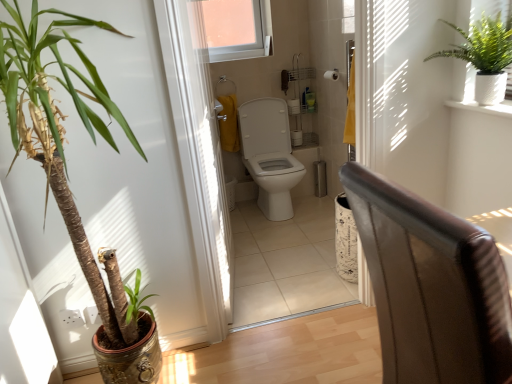
Question: Should I look upward or downward to see white plastic screen door at center?

Choices:
 (A) down
 (B) up

Answer: (B)

Question: From the image's perspective, would you say white matte toilet paper at upper center is shown under white glossy toilet at center?

Choices:
 (A) no
 (B) yes

Answer: (A)

Question: Considering the relative sizes of white matte toilet paper at upper center and white glossy toilet at center in the image provided, is white matte toilet paper at upper center wider than white glossy toilet at center?

Choices:
 (A) yes
 (B) no

Answer: (B)

Question: Considering the relative sizes of white matte toilet paper at upper center and white glossy toilet at center in the image provided, is white matte toilet paper at upper center smaller than white glossy toilet at center?

Choices:
 (A) no
 (B) yes

Answer: (B)

Question: Is white matte toilet paper at upper center far from white glossy toilet at center?

Choices:
 (A) yes
 (B) no

Answer: (B)

Question: Does white matte toilet paper at upper center come in front of white glossy toilet at center?

Choices:
 (A) no
 (B) yes

Answer: (A)

Question: Is white matte toilet paper at upper center positioned behind white glossy toilet at center?

Choices:
 (A) yes
 (B) no

Answer: (A)

Question: Considering the relative sizes of white plastic screen door at center and leather armchair at right in the image provided, is white plastic screen door at center smaller than leather armchair at right?

Choices:
 (A) no
 (B) yes

Answer: (B)

Question: Does white plastic screen door at center appear on the left side of leather armchair at right?

Choices:
 (A) yes
 (B) no

Answer: (A)

Question: Is white plastic screen door at center touching leather armchair at right?

Choices:
 (A) yes
 (B) no

Answer: (B)

Question: Is white plastic screen door at center aimed at leather armchair at right?

Choices:
 (A) no
 (B) yes

Answer: (A)

Question: Is white plastic screen door at center shorter than leather armchair at right?

Choices:
 (A) no
 (B) yes

Answer: (A)

Question: Is white plastic screen door at center positioned far away from leather armchair at right?

Choices:
 (A) yes
 (B) no

Answer: (A)

Question: Can you confirm if white glossy toilet at center is taller than green textured plant at upper right, the 2th houseplant positioned from the left?

Choices:
 (A) yes
 (B) no

Answer: (A)